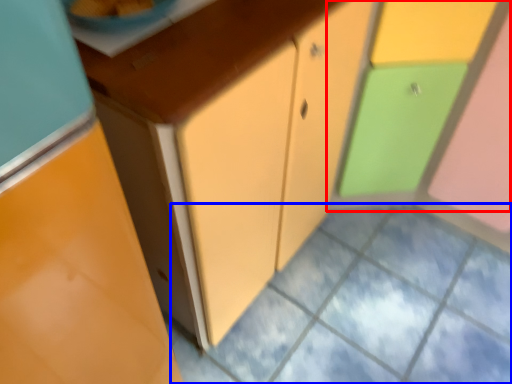
Question: Which of the following is the farthest to the observer, cabinetry (highlighted by a red box) or square (highlighted by a blue box)?

Choices:
 (A) cabinetry
 (B) square

Answer: (B)